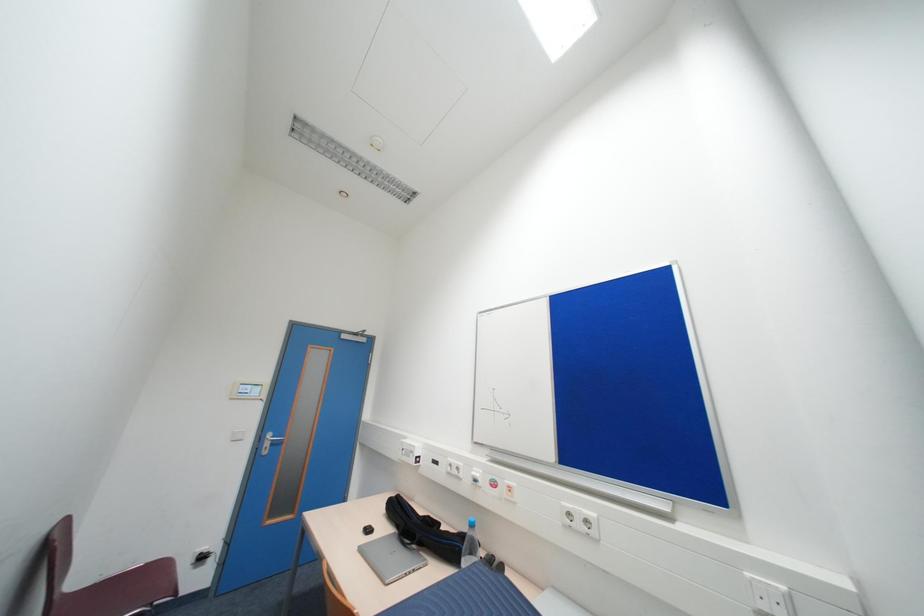
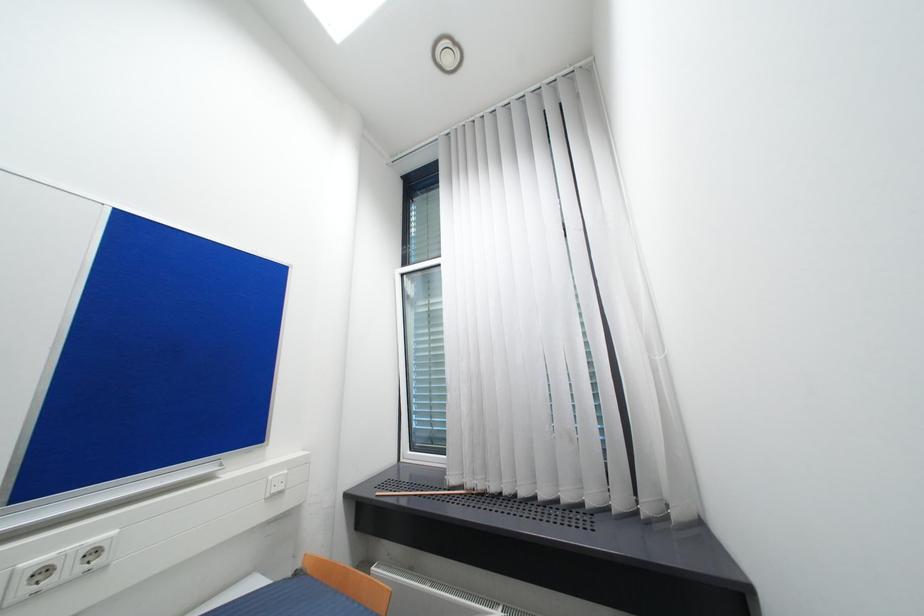
The images are taken continuously from a first-person perspective. In which direction is your viewpoint rotating?

The rotation direction of the camera is right-up.